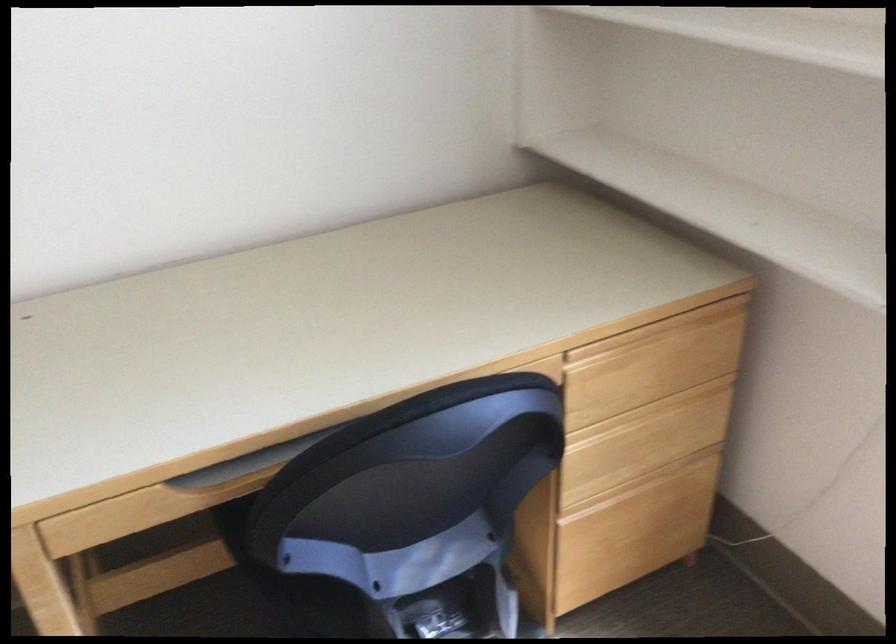
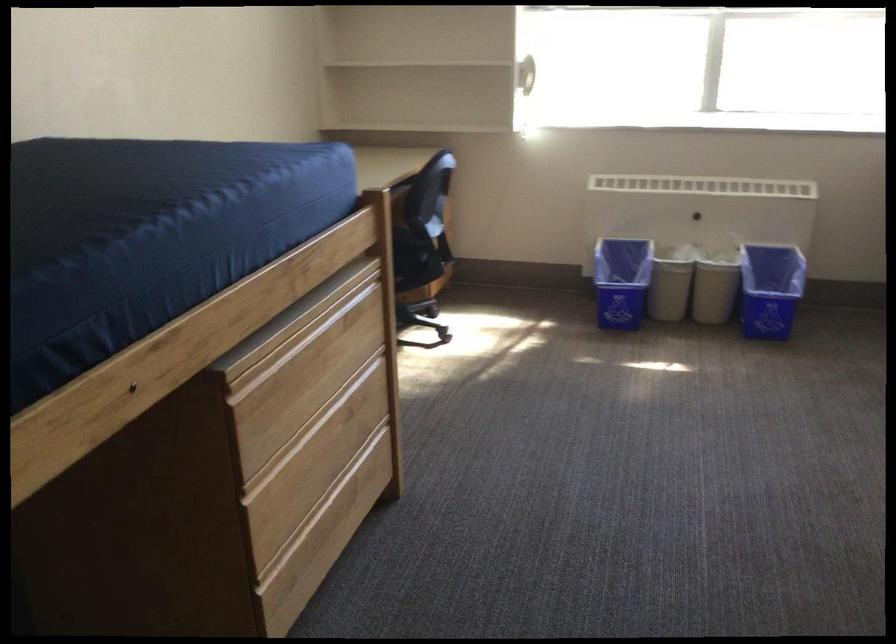
Question: I am providing you with two images of the same scene from different viewpoints. Which of the following objects are not visible in image2?

Choices:
 (A) chair sitting surface
 (B) red basket handle
 (C) blue recycling bin
 (D) wooden drawer handle

Answer: (A)